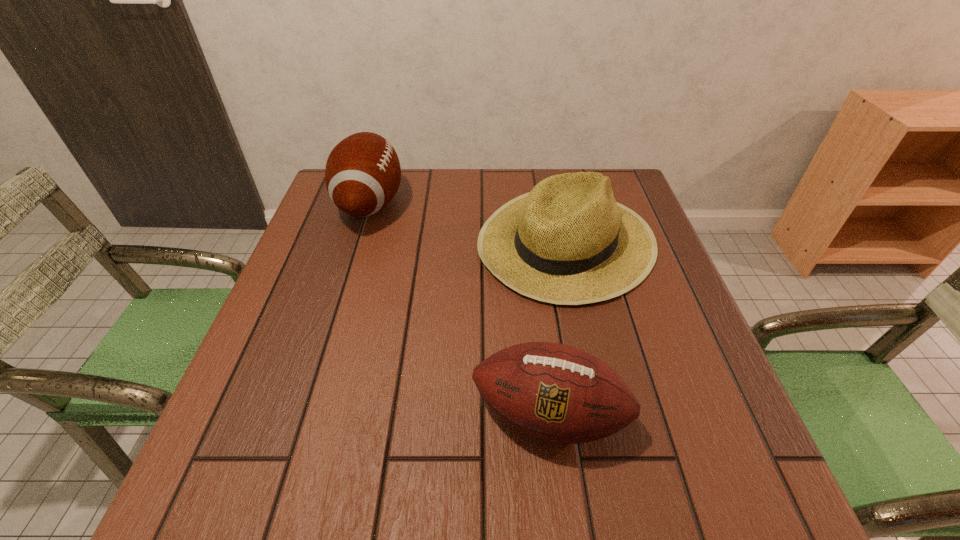
Image resolution: width=960 pixels, height=540 pixels. I want to click on the tallest object, so click(x=362, y=175).

Where is `the farther football (American)`? the farther football (American) is located at coordinates (362, 175).

This screenshot has width=960, height=540. In order to click on sunhat in this screenshot , I will do `click(568, 242)`.

You are a GUI agent. You are given a task and a screenshot of the screen. Output one action in this format:
    pyautogui.click(x=<x>, y=<y>)
    Task: Click on the shorter football (American)
    This screenshot has width=960, height=540.
    Given the screenshot: What is the action you would take?
    pyautogui.click(x=554, y=392)

Where is `the nearer football (American)`? This screenshot has width=960, height=540. the nearer football (American) is located at coordinates (554, 392).

The width and height of the screenshot is (960, 540). Find the location of `blank space located 0.150m on the laces of the farther football (American)`. blank space located 0.150m on the laces of the farther football (American) is located at coordinates (459, 204).

The width and height of the screenshot is (960, 540). I want to click on free space located on the left of the sunhat, so click(x=410, y=241).

Locate an element on the screen. The image size is (960, 540). vacant space located on the right of the shorter football (American) is located at coordinates tap(653, 415).

This screenshot has width=960, height=540. Find the location of `football present at the far edge`. football present at the far edge is located at coordinates (362, 175).

The image size is (960, 540). I want to click on sunhat present at the far edge, so click(568, 242).